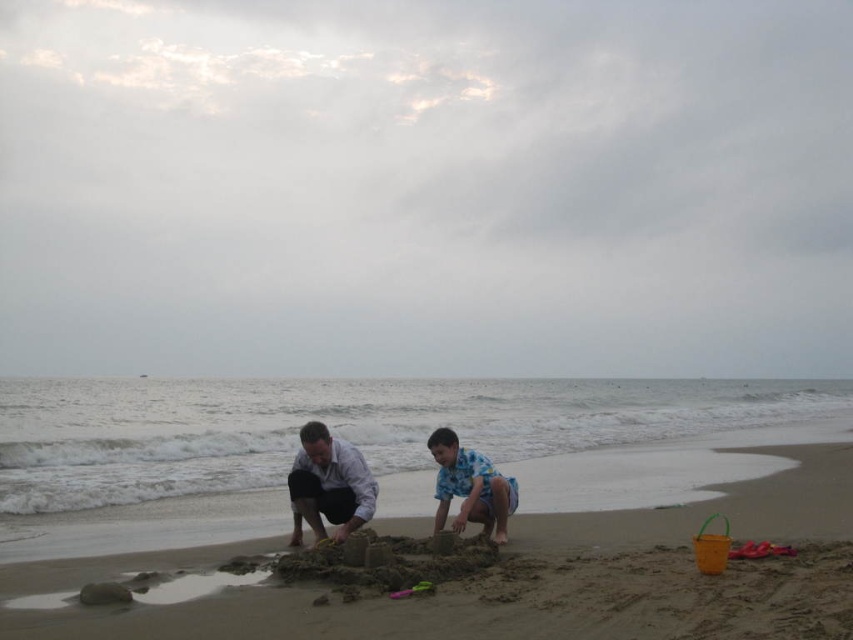
Who is positioned more to the left, brown sandcastle at center or blue printed shirt at center?

From the viewer's perspective, blue printed shirt at center appears more on the left side.

Who is shorter, brown sandcastle at center or blue printed shirt at center?

brown sandcastle at center is shorter.

Is point (128, 624) positioned behind point (445, 454)?

No, (128, 624) is in front of (445, 454).

I want to click on brown sandcastle at center, so click(491, 573).

Is point (640, 625) positioned in front of point (363, 515)?

Yes, point (640, 625) is closer to viewer.

Which is in front, point (486, 627) or point (325, 500)?

Point (486, 627) is more forward.

Where is `brown sandcastle at center`? brown sandcastle at center is located at coordinates (491, 573).

Is light blue shirt at center shorter than blue printed shirt at center?

No, light blue shirt at center is not shorter than blue printed shirt at center.

Which is in front, point (296, 458) or point (438, 488)?

Point (296, 458) is in front.

At what (x,y) coordinates should I click in order to perform the action: click on light blue shirt at center. Please return your answer as a coordinate pair (x, y). Image resolution: width=853 pixels, height=640 pixels. Looking at the image, I should click on (328, 484).